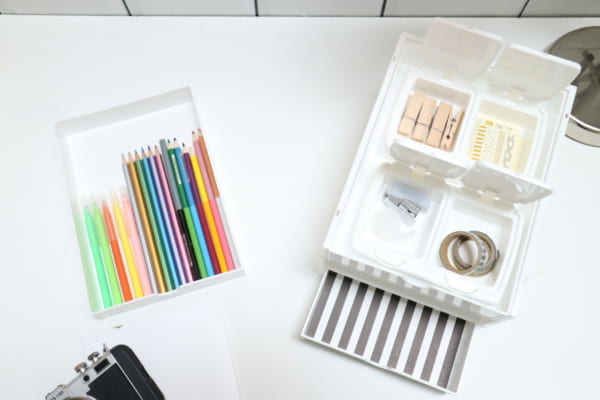
Locate an element on the screen. Image resolution: width=600 pixels, height=400 pixels. white tiles is located at coordinates (102, 9), (184, 9), (307, 6), (436, 7), (562, 6).